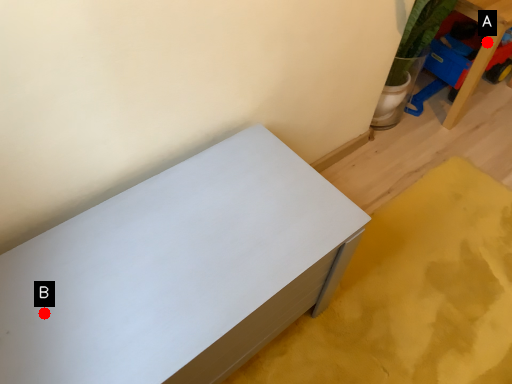
Question: Two points are circled on the image, labeled by A and B beside each circle. Among these points, which one is farthest from the camera?

Choices:
 (A) A is further
 (B) B is further

Answer: (A)